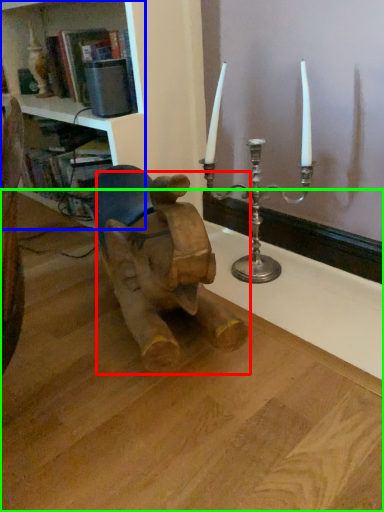
Question: Which is nearer to the baby elephant (highlighted by a red box)? shelf (highlighted by a blue box) or table (highlighted by a green box).

Choices:
 (A) shelf
 (B) table

Answer: (B)